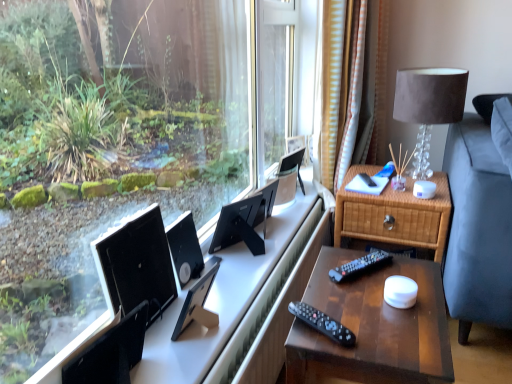
This screenshot has width=512, height=384. I want to click on free space to the right of matte black monitor at center, which appears as the second computer monitor when viewed from the front, so click(229, 326).